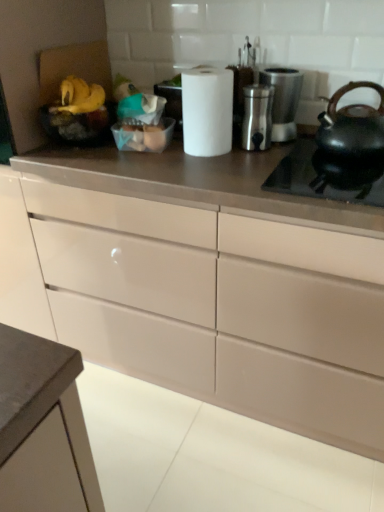
Measure the distance between matte white drawers at center and camera.

matte white drawers at center and camera are 3.36 feet apart.

Identify the location of satin silver container at center, the 1th appliance from the left. The image size is (384, 512). pos(257,117).

Measure the distance between point (68, 83) and camera.

They are 4.27 feet apart.

Locate an element on the screen. matte black kettle at right is located at coordinates (352, 125).

Find the location of a particular element. The height and width of the screenshot is (512, 384). satin silver coffee maker at upper right, the 1th appliance from the right is located at coordinates (283, 100).

Describe the element at coordinates (328, 175) in the screenshot. This screenshot has width=384, height=512. I see `black matte gas stove at right` at that location.

The height and width of the screenshot is (512, 384). What do you see at coordinates (207, 110) in the screenshot?
I see `white matte paper towel at center` at bounding box center [207, 110].

The width and height of the screenshot is (384, 512). I want to click on matte white drawers at center, so click(x=169, y=318).

Which object is thinner, matte white drawers at center or black matte gas stove at right?

Thinner between the two is black matte gas stove at right.

Between matte white drawers at center and black matte gas stove at right, which one has smaller size?

With smaller size is black matte gas stove at right.

Does matte white drawers at center lie in front of black matte gas stove at right?

Yes, matte white drawers at center is closer to the viewer.

Is matte white drawers at center looking in the opposite direction of black matte gas stove at right?

No, matte white drawers at center's orientation is not away from black matte gas stove at right.

From a real-world perspective, does satin silver container at center, which appears as the 2th appliance when viewed from the right, stand above matte white drawers at center?

Indeed, from a real-world perspective, satin silver container at center, which appears as the 2th appliance when viewed from the right, stands above matte white drawers at center.

Is the position of satin silver container at center, the 1th appliance from the left, less distant than that of matte white drawers at center?

No, it is not.

From the image's perspective, starting from the matte white drawers at center, which appliance is the 1st one above? Please provide its 2D coordinates.

[(257, 117)]

Based on the photo, considering the sizes of objects satin silver container at center, which appears as the 2th appliance when viewed from the right, and matte white drawers at center in the image provided, who is wider, satin silver container at center, which appears as the 2th appliance when viewed from the right, or matte white drawers at center?

Wider between the two is matte white drawers at center.

From the image's perspective, which one is positioned lower, satin silver coffee maker at upper right, which is counted as the 2th appliance, starting from the left, or matte black kettle at right?

From the image's view, matte black kettle at right is below.

How different are the orientations of satin silver coffee maker at upper right, which is counted as the 2th appliance, starting from the left, and matte black kettle at right in degrees?

0.69 degrees.

From the picture: Visually, is satin silver coffee maker at upper right, the 1th appliance from the right, positioned to the left or to the right of matte black kettle at right?

Based on their positions, satin silver coffee maker at upper right, the 1th appliance from the right, is located to the left of matte black kettle at right.

Looking at their sizes, would you say matte black kettle at right is wider or thinner than yellow matte bananas at upper left, which is the 2th food from right to left?

matte black kettle at right is wider than yellow matte bananas at upper left, which is the 2th food from right to left.

Based on the photo, between matte black kettle at right and yellow matte bananas at upper left, which appears as the first food when viewed from the left, which one has more height?

With more height is matte black kettle at right.

Which is in front, matte black kettle at right or yellow matte bananas at upper left, which is the 2th food from right to left?

Positioned in front is matte black kettle at right.

Is matte black kettle at right far away from yellow matte bananas at upper left, which appears as the first food when viewed from the left?

No, matte black kettle at right is in close proximity to yellow matte bananas at upper left, which appears as the first food when viewed from the left.

Looking at this image, does white matte paper towel at center turn towards satin silver container at center, the 1th appliance from the left?

→ No.

Does white matte paper towel at center touch satin silver container at center, which appears as the 2th appliance when viewed from the right?

They are not placed beside each other.

Would you say white matte paper towel at center is outside satin silver container at center, which appears as the 2th appliance when viewed from the right?

Indeed, white matte paper towel at center is completely outside satin silver container at center, which appears as the 2th appliance when viewed from the right.

Would you say satin silver coffee maker at upper right, the 1th appliance from the right, is part of matte white drawers at center's contents?

No, satin silver coffee maker at upper right, the 1th appliance from the right, is not a part of matte white drawers at center.

From a real-world perspective, is matte white drawers at center below satin silver coffee maker at upper right, which is counted as the 2th appliance, starting from the left?

Yes, from a real-world perspective, matte white drawers at center is under satin silver coffee maker at upper right, which is counted as the 2th appliance, starting from the left.

Does matte white drawers at center appear on the right side of satin silver coffee maker at upper right, the 1th appliance from the right?

No.

Between matte white drawers at center and satin silver coffee maker at upper right, the 1th appliance from the right, which one is positioned in front?

matte white drawers at center is more forward.

Looking at this image, which point is more forward, (x=260, y=140) or (x=208, y=149)?

Point (x=208, y=149)

What's the angular difference between satin silver container at center, which appears as the 2th appliance when viewed from the right, and white matte paper towel at center's facing directions?

The angle between the facing direction of satin silver container at center, which appears as the 2th appliance when viewed from the right, and the facing direction of white matte paper towel at center is 21.3 degrees.

Considering the relative sizes of satin silver container at center, the 1th appliance from the left, and white matte paper towel at center in the image provided, is satin silver container at center, the 1th appliance from the left, wider than white matte paper towel at center?

No, satin silver container at center, the 1th appliance from the left, is not wider than white matte paper towel at center.

Looking at this image, from a real-world perspective, is satin silver container at center, the 1th appliance from the left, located beneath white matte paper towel at center?

Yes.

Where is `cabinetry to the left of black matte gas stove at right`? The height and width of the screenshot is (512, 384). cabinetry to the left of black matte gas stove at right is located at coordinates (169, 318).

What are the coordinates of `cabinetry that is under the satin silver container at center, which appears as the 2th appliance when viewed from the right (from a real-world perspective)` in the screenshot? It's located at (169, 318).

Looking at the image, which one is located closer to translucent plastic eggs at center, the first food viewed from the right, satin silver container at center, which appears as the 2th appliance when viewed from the right, or satin silver coffee maker at upper right, the 1th appliance from the right?

satin silver container at center, which appears as the 2th appliance when viewed from the right, is closer to translucent plastic eggs at center, the first food viewed from the right.

Looking at the image, which one is located further to black matte gas stove at right, yellow matte bananas at upper left, which is the 2th food from right to left, or translucent plastic eggs at center, the first food viewed from the right?

Based on the image, yellow matte bananas at upper left, which is the 2th food from right to left, appears to be further to black matte gas stove at right.

Estimate the real-world distances between objects in this image. Which object is closer to translucent plastic eggs at center, arranged as the 2th food when viewed from the left, matte black kettle at right or black matte gas stove at right?

black matte gas stove at right is positioned closer to the anchor translucent plastic eggs at center, arranged as the 2th food when viewed from the left.

Based on their spatial positions, is matte white drawers at center or satin silver coffee maker at upper right, the 1th appliance from the right, closer to satin silver container at center, the 1th appliance from the left?

The object closer to satin silver container at center, the 1th appliance from the left, is satin silver coffee maker at upper right, the 1th appliance from the right.

Looking at the image, which one is located closer to matte black kettle at right, white matte paper towel at center or satin silver container at center, which appears as the 2th appliance when viewed from the right?

Based on the image, satin silver container at center, which appears as the 2th appliance when viewed from the right, appears to be nearer to matte black kettle at right.

Looking at the image, which one is located further to matte white drawers at center, yellow matte bananas at upper left, which appears as the first food when viewed from the left, or satin silver container at center, which appears as the 2th appliance when viewed from the right?

yellow matte bananas at upper left, which appears as the first food when viewed from the left, is positioned further to the anchor matte white drawers at center.

Estimate the real-world distances between objects in this image. Which object is closer to matte white drawers at center, translucent plastic eggs at center, arranged as the 2th food when viewed from the left, or black matte gas stove at right?

black matte gas stove at right lies closer to matte white drawers at center than the other object.

Which object lies further to the anchor point satin silver container at center, the 1th appliance from the left, translucent plastic eggs at center, arranged as the 2th food when viewed from the left, or matte black kettle at right?

translucent plastic eggs at center, arranged as the 2th food when viewed from the left.

The height and width of the screenshot is (512, 384). I want to click on tea pot between matte white drawers at center and yellow matte bananas at upper left, which is the 2th food from right to left, in the front-back direction, so click(x=352, y=125).

You are a GUI agent. You are given a task and a screenshot of the screen. Output one action in this format:
    pyautogui.click(x=<x>, y=<y>)
    Task: Click on the gas stove situated between yellow matte bananas at upper left, which appears as the first food when viewed from the left, and matte black kettle at right from left to right
    
    Given the screenshot: What is the action you would take?
    pyautogui.click(x=328, y=175)

Locate an element on the screen. gas stove between translucent plastic eggs at center, the first food viewed from the right, and matte black kettle at right is located at coordinates (328, 175).

Locate an element on the screen. This screenshot has width=384, height=512. paper towel located between matte white drawers at center and satin silver container at center, which appears as the 2th appliance when viewed from the right, in the depth direction is located at coordinates (207, 110).